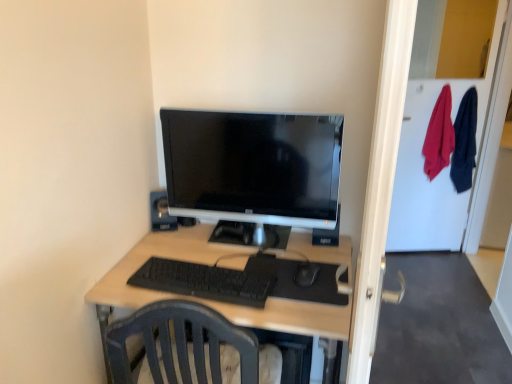
Question: Is black plastic speaker at upper center smaller than black plastic mouse at center?

Choices:
 (A) yes
 (B) no

Answer: (B)

Question: Is the surface of black plastic speaker at upper center in direct contact with black plastic mouse at center?

Choices:
 (A) yes
 (B) no

Answer: (B)

Question: Is black plastic speaker at upper center bigger than black plastic mouse at center?

Choices:
 (A) no
 (B) yes

Answer: (B)

Question: Is black plastic speaker at upper center shorter than black plastic mouse at center?

Choices:
 (A) no
 (B) yes

Answer: (A)

Question: Could you tell me if black plastic speaker at upper center is facing black plastic mouse at center?

Choices:
 (A) yes
 (B) no

Answer: (B)

Question: Does black plastic speaker at upper center have a greater height compared to black plastic mouse at center?

Choices:
 (A) yes
 (B) no

Answer: (A)

Question: Are black matte keyboard at center and black plastic mouse at center located far from each other?

Choices:
 (A) yes
 (B) no

Answer: (B)

Question: Can you confirm if black matte keyboard at center is smaller than black plastic mouse at center?

Choices:
 (A) yes
 (B) no

Answer: (B)

Question: From the image's perspective, is black matte keyboard at center beneath black plastic mouse at center?

Choices:
 (A) yes
 (B) no

Answer: (A)

Question: From a real-world perspective, is black matte keyboard at center physically below black plastic mouse at center?

Choices:
 (A) yes
 (B) no

Answer: (B)

Question: From a real-world perspective, is black matte keyboard at center positioned over black plastic mouse at center based on gravity?

Choices:
 (A) yes
 (B) no

Answer: (A)

Question: Could black plastic mouse at center be considered to be inside black matte keyboard at center?

Choices:
 (A) yes
 (B) no

Answer: (B)

Question: Is black plastic mouse at center positioned with its back to black plastic speaker at upper center?

Choices:
 (A) no
 (B) yes

Answer: (A)